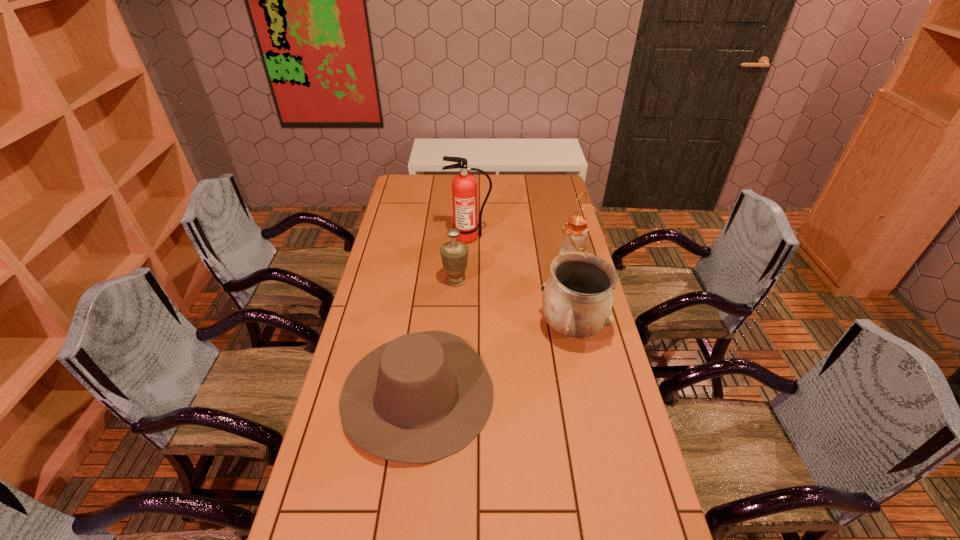
Image resolution: width=960 pixels, height=540 pixels. I want to click on vacant space that is in between the fire extinguisher and the right urn, so click(520, 282).

I want to click on empty space that is in between the farthest object and the oil lamp, so click(x=519, y=251).

You are a GUI agent. You are given a task and a screenshot of the screen. Output one action in this format:
    pyautogui.click(x=<x>, y=<y>)
    Task: Click on the free spot between the second tallest object and the fire extinguisher
    
    Given the screenshot: What is the action you would take?
    (x=519, y=251)

Find the location of a particular element. Image resolution: width=960 pixels, height=540 pixels. free point between the cowboy hat and the second tallest object is located at coordinates (494, 328).

This screenshot has width=960, height=540. I want to click on free area in between the cowboy hat and the nearer urn, so click(494, 360).

Find the location of a particular element. This screenshot has width=960, height=540. vacant region between the cowboy hat and the oil lamp is located at coordinates (494, 328).

At what (x,y) coordinates should I click in order to perform the action: click on object that stands as the fourth closest to the shortest object. Please return your answer as a coordinate pair (x, y). Image resolution: width=960 pixels, height=540 pixels. Looking at the image, I should click on (464, 185).

Choose which object is the fourth nearest neighbor to the fire extinguisher. Please provide its 2D coordinates. Your answer should be formatted as a tuple, i.e. [(x, y)], where the tuple contains the x and y coordinates of a point satisfying the conditions above.

[(422, 397)]

You are a GUI agent. You are given a task and a screenshot of the screen. Output one action in this format:
    pyautogui.click(x=<x>, y=<y>)
    Task: Click on the vacant region that satisfies the following two spatial constraints: 1. on the back side of the cowboy hat; 2. on the left side of the oil lamp
    Image resolution: width=960 pixels, height=540 pixels.
    Given the screenshot: What is the action you would take?
    pyautogui.click(x=434, y=264)

Locate an element on the screen. This screenshot has width=960, height=540. vacant space that satisfies the following two spatial constraints: 1. on the back side of the farther urn; 2. on the right side of the second tallest object is located at coordinates click(x=457, y=264).